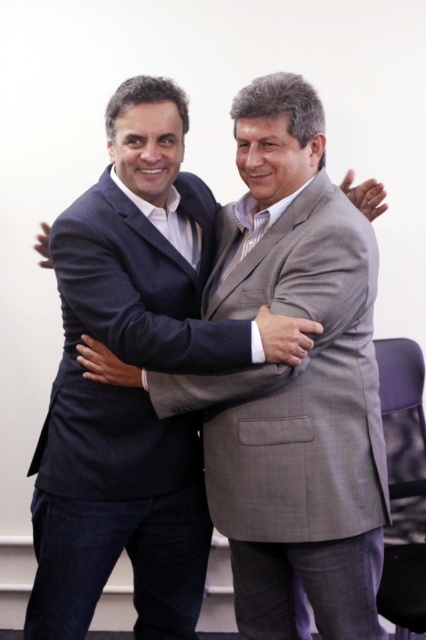
Question: In this image, where is matte black suit at center located relative to matte black suit at left?

Choices:
 (A) right
 (B) left

Answer: (A)

Question: Is matte black suit at center further to camera compared to matte black suit at left?

Choices:
 (A) no
 (B) yes

Answer: (B)

Question: Which object appears closest to the camera in this image?

Choices:
 (A) matte black suit at left
 (B) matte black suit at center

Answer: (A)

Question: Is matte black suit at center positioned before matte black suit at left?

Choices:
 (A) yes
 (B) no

Answer: (B)